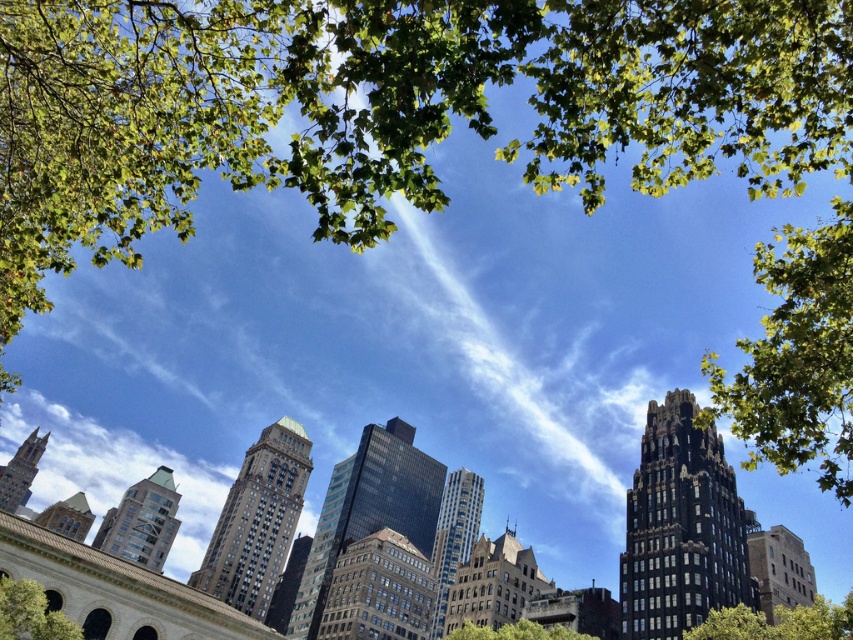
Question: Is green leafy tree at lower left to the left of green leafy tree at center from the viewer's perspective?

Choices:
 (A) yes
 (B) no

Answer: (A)

Question: Which object is farther from the camera taking this photo?

Choices:
 (A) green leafy tree at lower left
 (B) green leafy tree at center

Answer: (B)

Question: Which point appears closest to the camera in this image?

Choices:
 (A) (503, 625)
 (B) (39, 630)
 (C) (780, 612)

Answer: (B)

Question: Which object is closer to the camera taking this photo?

Choices:
 (A) green leafy tree at center
 (B) green leafy tree at lower right

Answer: (B)

Question: Can you confirm if green leafy tree at lower right is wider than green leafy tree at lower left?

Choices:
 (A) no
 (B) yes

Answer: (B)

Question: Is green leafy tree at lower right positioned behind green leafy tree at lower left?

Choices:
 (A) no
 (B) yes

Answer: (B)